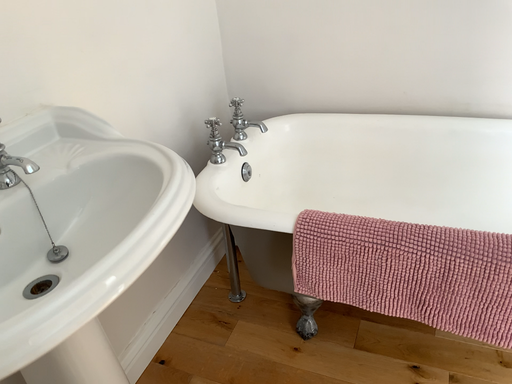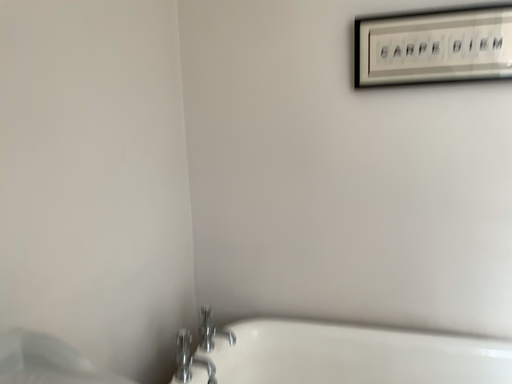
Question: Which way did the camera rotate in the video?

Choices:
 (A) rotated downward
 (B) rotated upward

Answer: (B)